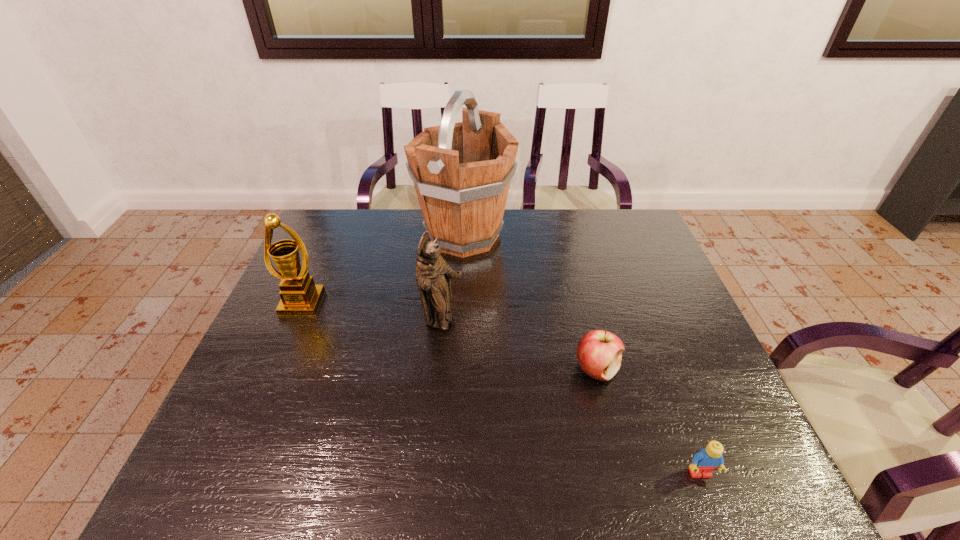
Locate an element on the screen. This screenshot has width=960, height=540. vacant region at the right edge of the desktop is located at coordinates click(658, 281).

Where is `vacant space at the far left corner of the desktop`? The width and height of the screenshot is (960, 540). vacant space at the far left corner of the desktop is located at coordinates (335, 227).

Locate an element on the screen. free space at the near left corner of the desktop is located at coordinates (242, 476).

You are a GUI agent. You are given a task and a screenshot of the screen. Output one action in this format:
    pyautogui.click(x=<x>, y=<y>)
    Task: Click on the blank area at the far right corner
    The width and height of the screenshot is (960, 540).
    Given the screenshot: What is the action you would take?
    pyautogui.click(x=641, y=219)

I want to click on free space between the leftmost object and the apple, so click(x=449, y=336).

This screenshot has width=960, height=540. In order to click on vacant space that is in between the figurine and the fourth farthest object in this screenshot , I will do `click(519, 345)`.

What are the coordinates of `empty location between the Lego and the fourth farthest object` in the screenshot? It's located at (648, 421).

You are a GUI agent. You are given a task and a screenshot of the screen. Output one action in this format:
    pyautogui.click(x=<x>, y=<y>)
    Task: Click on the free spot between the nearest object and the award
    The image size is (960, 540).
    Given the screenshot: What is the action you would take?
    pyautogui.click(x=501, y=388)

The height and width of the screenshot is (540, 960). In order to click on empty space between the bucket and the apple in this screenshot , I will do `click(530, 302)`.

The image size is (960, 540). Identify the location of free point between the award and the apple. [449, 336].